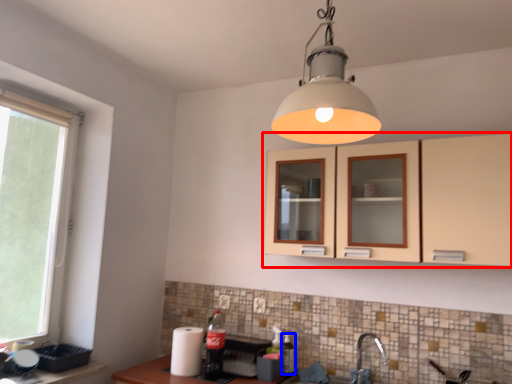
Question: Which of the following is the closest to the observer, cabinetry (highlighted by a red box) or bottle (highlighted by a blue box)?

Choices:
 (A) cabinetry
 (B) bottle

Answer: (A)